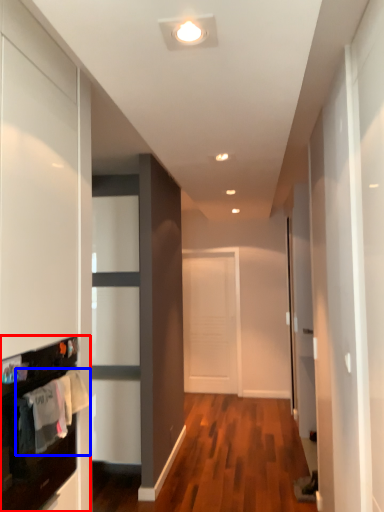
Question: Which object appears farthest to the camera in this image, cabinetry (highlighted by a red box) or laundry (highlighted by a blue box)?

Choices:
 (A) cabinetry
 (B) laundry

Answer: (B)